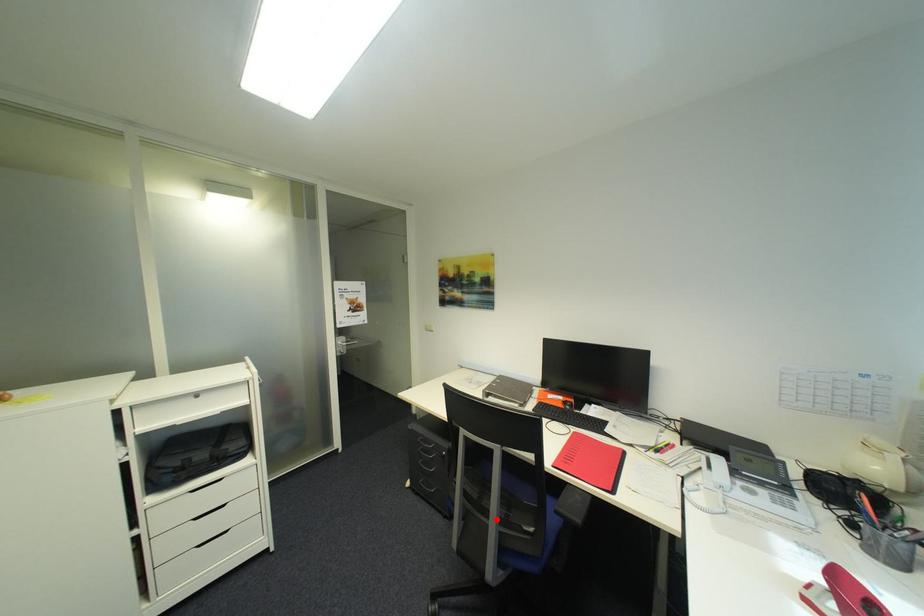
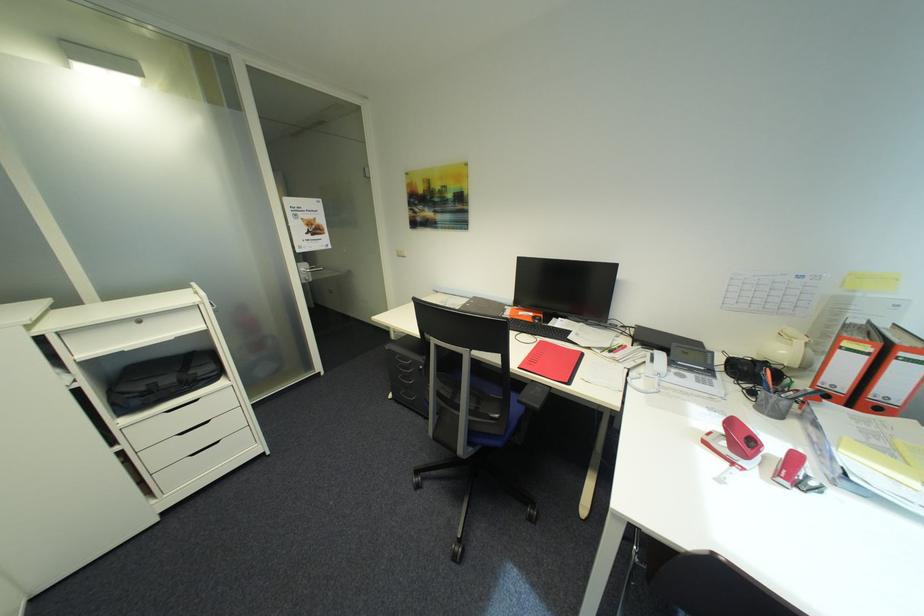
Where in the second image is the point corresponding to the highlighted location from the first image?

(467, 411)